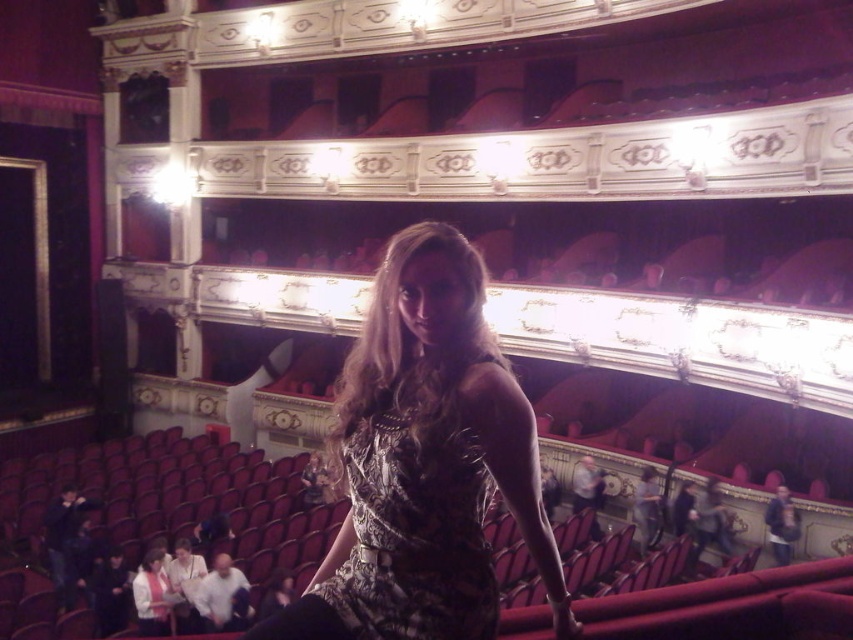
Consider the image. Can you confirm if metallic dress at center is bigger than printed fabric dress at center?

Correct, metallic dress at center is larger in size than printed fabric dress at center.

Between metallic dress at center and printed fabric dress at center, which one has less height?

With less height is printed fabric dress at center.

Is point (444, 492) positioned behind point (482, 557)?

No.

At what (x,y) coordinates should I click in order to perform the action: click on metallic dress at center. Please return your answer as a coordinate pair (x, y). This screenshot has width=853, height=640. Looking at the image, I should click on (425, 461).